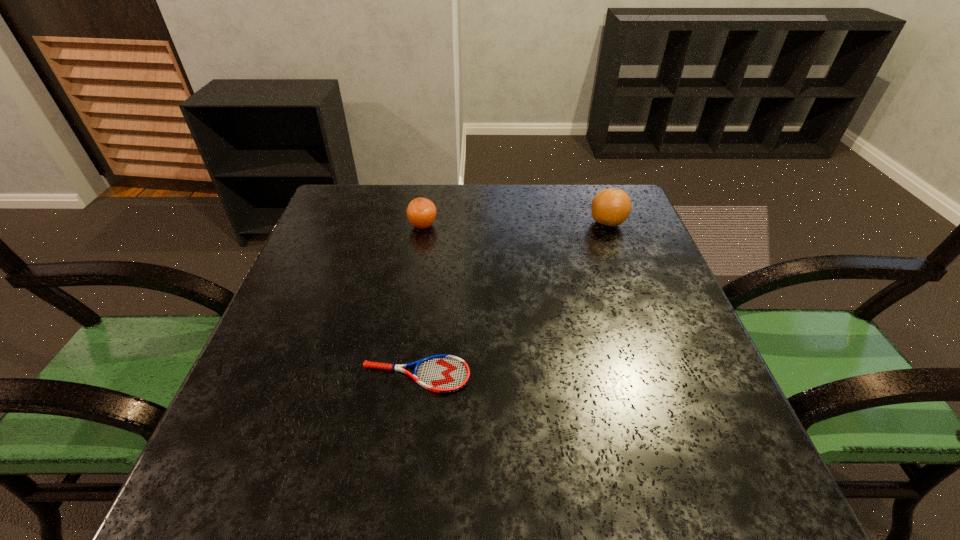
Identify the location of blank region between the nearest object and the taller orange. (512, 299).

At what (x,y) coordinates should I click in order to perform the action: click on vacant region between the shortest object and the shorter orange. Please return your answer as a coordinate pair (x, y). Looking at the image, I should click on (420, 300).

Image resolution: width=960 pixels, height=540 pixels. Identify the location of blank region between the shorter orange and the taller orange. (516, 224).

Where is `free area in between the taller orange and the left orange`? The image size is (960, 540). free area in between the taller orange and the left orange is located at coordinates (516, 224).

In order to click on empty location between the second shortest object and the tennis racket in this screenshot , I will do `click(420, 300)`.

This screenshot has width=960, height=540. In order to click on blank region between the shortest object and the shorter orange in this screenshot , I will do `click(420, 300)`.

Where is `vacant point located between the taller orange and the left orange`? The width and height of the screenshot is (960, 540). vacant point located between the taller orange and the left orange is located at coordinates (516, 224).

Where is `vacant region between the shorter orange and the tennis racket`? vacant region between the shorter orange and the tennis racket is located at coordinates (420, 300).

The width and height of the screenshot is (960, 540). What are the coordinates of `object that is the second closest to the left orange` in the screenshot? It's located at (611, 207).

Identify the location of object that stands as the closest to the tallest object. This screenshot has height=540, width=960. (421, 212).